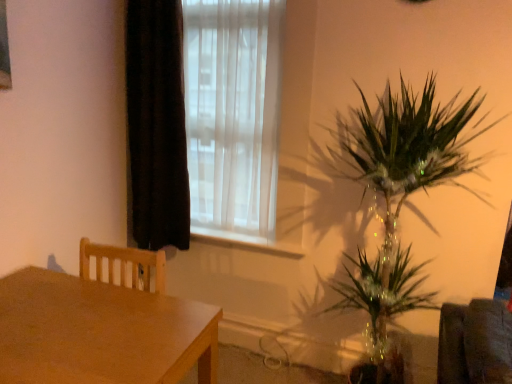
The height and width of the screenshot is (384, 512). What do you see at coordinates (232, 117) in the screenshot?
I see `white sheer curtain at upper center` at bounding box center [232, 117].

What is the approximate width of white sheer curtain at upper center?

5.63 inches.

In order to face black velvet curtain at left, should I rotate leftwards or rightwards?

Turn left by 12.682 degrees to look at black velvet curtain at left.

Where is `white plastic window sill at center`? This screenshot has width=512, height=384. white plastic window sill at center is located at coordinates (245, 242).

At what (x,y) coordinates should I click in order to perform the action: click on white sheer curtain at upper center. Please return your answer as a coordinate pair (x, y). Looking at the image, I should click on (232, 117).

Who is bigger, wooden table at left or white sheer curtain at upper center?

wooden table at left is bigger.

Can you see wooden table at left touching white sheer curtain at upper center?

No, wooden table at left is not next to white sheer curtain at upper center.

Would you say white sheer curtain at upper center is part of wooden table at left's contents?

No, wooden table at left does not contain white sheer curtain at upper center.

Based on the photo, what's the angular difference between wooden table at left and white sheer curtain at upper center's facing directions?

The facing directions of wooden table at left and white sheer curtain at upper center are 89.8 degrees apart.

Which is closer, (148, 106) or (105, 307)?

Point (148, 106).

From a real-world perspective, is black velvet curtain at left above or below wooden table at left?

From a real-world perspective, black velvet curtain at left is physically above wooden table at left.

Is black velvet curtain at left next to wooden table at left and touching it?

No.

From the image's perspective, would you say black velvet curtain at left is positioned over wooden table at left?

Yes, from the image's perspective, black velvet curtain at left is over wooden table at left.

From the picture: From a real-world perspective, is wooden table at left located higher than white plastic window sill at center?

No.

Is wooden table at left facing towards white plastic window sill at center?

No, wooden table at left does not turn towards white plastic window sill at center.

Who is taller, wooden table at left or white plastic window sill at center?

Standing taller between the two is wooden table at left.

Which is more to the right, wooden table at left or white plastic window sill at center?

white plastic window sill at center.

Is white sheer curtain at upper center in contact with wooden table at left?

No, white sheer curtain at upper center is not in contact with wooden table at left.

Which is in front, point (228, 115) or point (67, 284)?

The point (67, 284) is closer to the camera.

Considering the positions of objects white sheer curtain at upper center and wooden table at left in the image provided, who is in front, white sheer curtain at upper center or wooden table at left?

wooden table at left.

Between white sheer curtain at upper center and wooden table at left, which one appears on the left side from the viewer's perspective?

wooden table at left is more to the left.

From a real-world perspective, which is physically above, white plastic window sill at center or black velvet curtain at left?

From a 3D spatial view, black velvet curtain at left is above.

How far apart are white plastic window sill at center and black velvet curtain at left?

A distance of 21.91 inches exists between white plastic window sill at center and black velvet curtain at left.

Is white plastic window sill at center turned away from black velvet curtain at left?

No.

Which is correct: white plastic window sill at center is inside black velvet curtain at left, or outside of it?

The correct answer is: outside.

Identify the location of curtain below the white sheer curtain at upper center (from the image's perspective). This screenshot has height=384, width=512. (156, 125).

Between black velvet curtain at left and white sheer curtain at upper center, which one is positioned behind?

black velvet curtain at left is more distant.

Is black velvet curtain at left oriented away from white sheer curtain at upper center?

Yes, black velvet curtain at left's orientation is away from white sheer curtain at upper center.

Can you confirm if black velvet curtain at left is taller than white sheer curtain at upper center?

Indeed, black velvet curtain at left has a greater height compared to white sheer curtain at upper center.

Is wooden table at left smaller than black velvet curtain at left?

Actually, wooden table at left might be larger than black velvet curtain at left.

Is black velvet curtain at left at the back of wooden table at left?

That's not correct — wooden table at left is not looking away from black velvet curtain at left.

In the scene shown: From a real-world perspective, is wooden table at left above or below black velvet curtain at left?

From a real-world perspective, wooden table at left is physically below black velvet curtain at left.

In order to click on window on the right of wooden table at left in this screenshot , I will do `click(232, 117)`.

Image resolution: width=512 pixels, height=384 pixels. What are the coordinates of `curtain above the wooden table at left (from the image's perspective)` in the screenshot? It's located at (156, 125).

When comparing their distances from white sheer curtain at upper center, does black velvet curtain at left or white plastic window sill at center seem further?

white plastic window sill at center is further to white sheer curtain at upper center.

Consider the image. Looking at the image, which one is located closer to white plastic window sill at center, black velvet curtain at left or wooden table at left?

Based on the image, black velvet curtain at left appears to be nearer to white plastic window sill at center.

Considering their positions, is white sheer curtain at upper center positioned closer to wooden table at left than black velvet curtain at left?

black velvet curtain at left.

From the image, which object appears to be nearer to white plastic window sill at center, white sheer curtain at upper center or wooden table at left?

white sheer curtain at upper center lies closer to white plastic window sill at center than the other object.

From the image, which object appears to be nearer to wooden table at left, white plastic window sill at center or black velvet curtain at left?

Among the two, white plastic window sill at center is located nearer to wooden table at left.

Considering their positions, is black velvet curtain at left positioned closer to wooden table at left than white plastic window sill at center?

white plastic window sill at center is positioned closer to the anchor wooden table at left.

Estimate the real-world distances between objects in this image. Which object is closer to white sheer curtain at upper center, black velvet curtain at left or wooden table at left?

black velvet curtain at left.

Considering their positions, is wooden table at left positioned closer to white sheer curtain at upper center than black velvet curtain at left?

black velvet curtain at left lies closer to white sheer curtain at upper center than the other object.

Image resolution: width=512 pixels, height=384 pixels. I want to click on curtain between white sheer curtain at upper center and white plastic window sill at center from top to bottom, so click(x=156, y=125).

The width and height of the screenshot is (512, 384). In order to click on curtain between white sheer curtain at upper center and wooden table at left from top to bottom in this screenshot , I will do `click(156, 125)`.

The width and height of the screenshot is (512, 384). Find the location of `curtain positioned between wooden table at left and white plastic window sill at center from near to far`. curtain positioned between wooden table at left and white plastic window sill at center from near to far is located at coordinates (156, 125).

Find the location of a particular element. Image resolution: width=512 pixels, height=384 pixels. window positioned between wooden table at left and white plastic window sill at center from near to far is located at coordinates (232, 117).